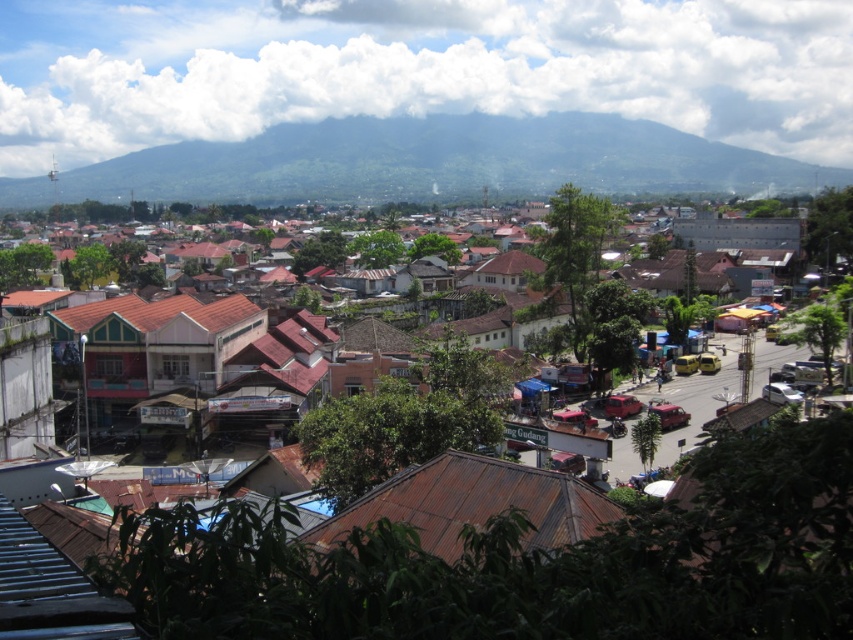
Locate an element on the screen. Image resolution: width=853 pixels, height=640 pixels. brown corrugated metal roofs at center is located at coordinates (531, 563).

Locate an element on the screen. The image size is (853, 640). brown corrugated metal roofs at center is located at coordinates (531, 563).